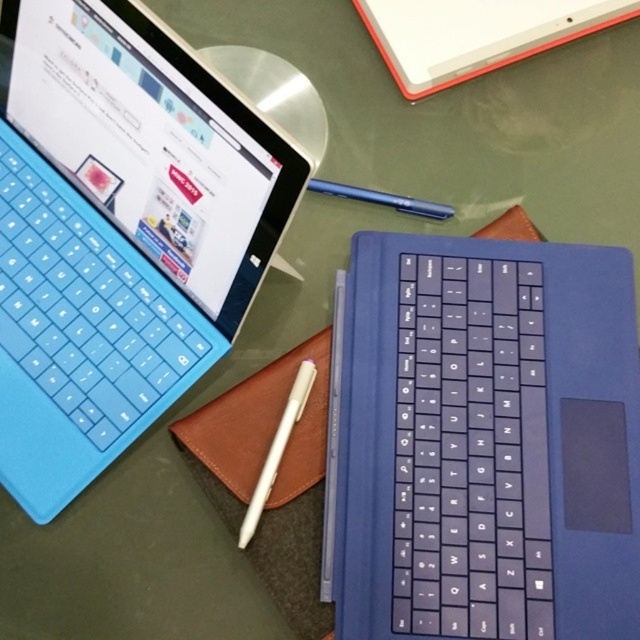
Who is positioned more to the right, blue rubberized keyboard at upper left or blue metallic pen at upper center?

blue metallic pen at upper center

In the scene shown: Which of these two, blue rubberized keyboard at upper left or blue metallic pen at upper center, stands shorter?

blue metallic pen at upper center

Does point (99, 44) come in front of point (445, 211)?

Yes, it is in front of point (445, 211).

Locate an element on the screen. blue rubberized keyboard at upper left is located at coordinates (120, 236).

Looking at this image, is blue rubberized keyboard at upper left smaller than leather notepad at center?

No, blue rubberized keyboard at upper left is not smaller than leather notepad at center.

Describe the element at coordinates (120, 236) in the screenshot. I see `blue rubberized keyboard at upper left` at that location.

Locate an element on the screen. blue rubberized keyboard at upper left is located at coordinates (120, 236).

Who is taller, white matte pen at center or blue metallic pen at upper center?

white matte pen at center is taller.

Does white matte pen at center have a greater height compared to blue metallic pen at upper center?

Yes, white matte pen at center is taller than blue metallic pen at upper center.

Is point (291, 413) in front of point (419, 211)?

Yes.

Identify the location of white matte pen at center. This screenshot has width=640, height=640. coord(276,449).